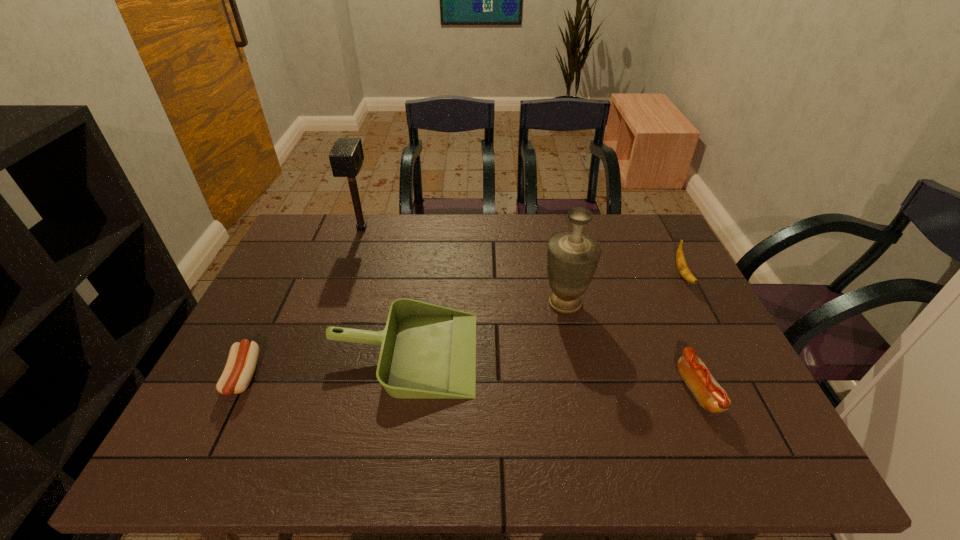
At what (x,y) coordinates should I click in order to perform the action: click on the farthest object. Please return your answer as a coordinate pair (x, y). Looking at the image, I should click on (346, 157).

Where is `urn`? This screenshot has height=540, width=960. urn is located at coordinates (572, 257).

You are a GUI agent. You are given a task and a screenshot of the screen. Output one action in this format:
    pyautogui.click(x=<x>, y=<y>)
    Task: Click on the dustpan
    
    Given the screenshot: What is the action you would take?
    pyautogui.click(x=428, y=351)

This screenshot has width=960, height=540. What are the coordinates of `banana` in the screenshot? It's located at (682, 266).

Where is `the taller sausage`? The width and height of the screenshot is (960, 540). the taller sausage is located at coordinates (709, 394).

You are a GUI agent. You are given a task and a screenshot of the screen. Output one action in this format:
    pyautogui.click(x=<x>, y=<y>)
    Task: Click on the fifth tallest object
    
    Given the screenshot: What is the action you would take?
    pyautogui.click(x=709, y=394)

You are a GUI agent. You are given a task and a screenshot of the screen. Output one action in this format:
    pyautogui.click(x=<x>, y=<y>)
    Task: Click on the leftmost object
    This screenshot has height=540, width=960.
    Given the screenshot: What is the action you would take?
    pyautogui.click(x=242, y=360)

Find the location of a particular element. The height and width of the screenshot is (540, 960). the shorter sausage is located at coordinates (242, 360).

Locate an element on the screen. free spot located on the right of the mallet is located at coordinates coord(455,228).

Identify the location of free space located on the front of the third object from right to left. The image size is (960, 540). (598, 460).